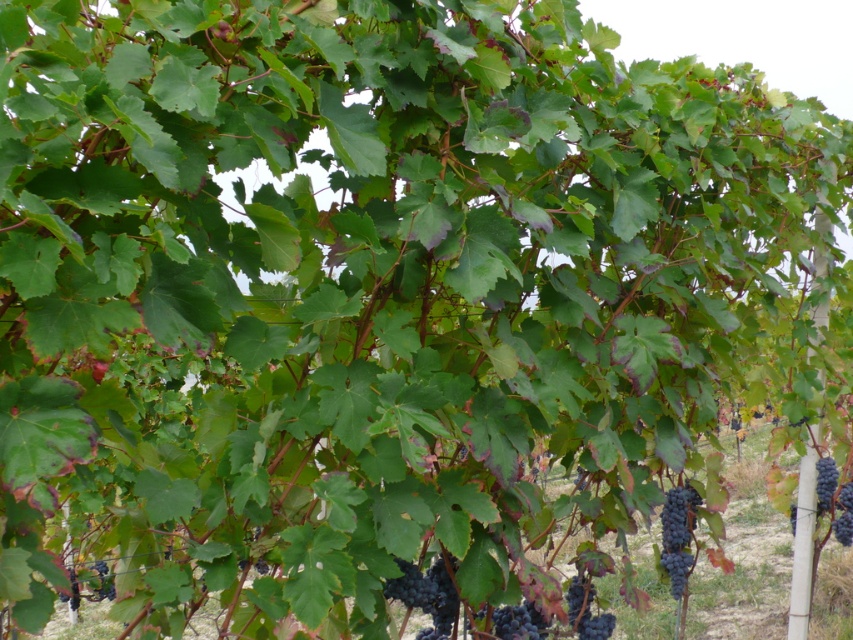
You are a farmer checking the spacing between the dark purple grapes at lower center. The recommended spacing for optimal growth is 2 meters. Is the current spacing sufficient?

The dark purple grapes at lower center are 2.10 meters apart, which exceeds the recommended 2 meters for optimal growth. Therefore, the current spacing is sufficient.

You are a farmer checking the grapevines in the vineyard. You notice a point marked at coordinate [677,534]. What is located at this point?

The point marked at coordinate [677,534] indicates the location of dark purple grapes at lower right.

You are a farmer checking the grapevines and notice two grapes in the image. The first is the dark purple grapes at lower right and the second is the purple matte grape at lower left. Which one is positioned to the right of the other?

The dark purple grapes at lower right are positioned to the right of the purple matte grape at lower left.